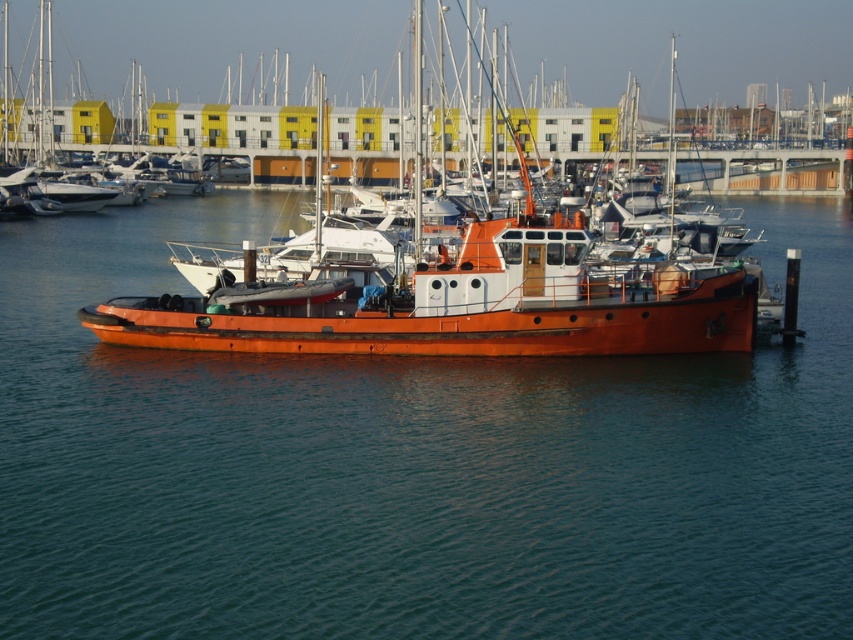
Question: Which point appears closest to the camera in this image?

Choices:
 (A) (616, 332)
 (B) (602, 532)

Answer: (B)

Question: Does glossy water at center appear under orange polished wood boat at center?

Choices:
 (A) no
 (B) yes

Answer: (B)

Question: Which of the following is the farthest from the observer?

Choices:
 (A) glossy water at center
 (B) orange polished wood boat at center

Answer: (B)

Question: From the image, what is the correct spatial relationship of glossy water at center in relation to orange polished wood boat at center?

Choices:
 (A) above
 (B) below

Answer: (B)

Question: Is glossy water at center positioned in front of orange polished wood boat at center?

Choices:
 (A) yes
 (B) no

Answer: (A)

Question: Among these objects, which one is farthest from the camera?

Choices:
 (A) glossy water at center
 (B) orange polished wood boat at center

Answer: (B)